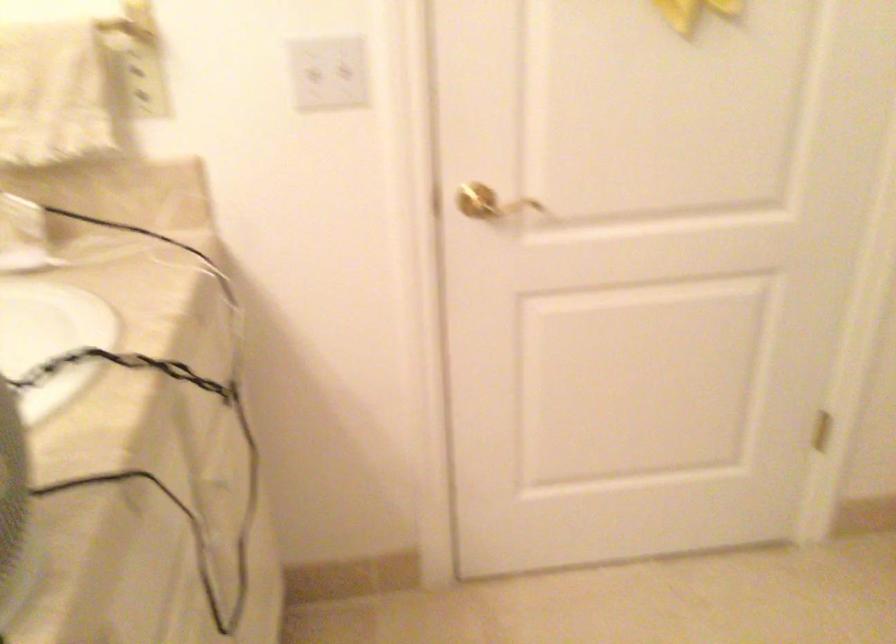
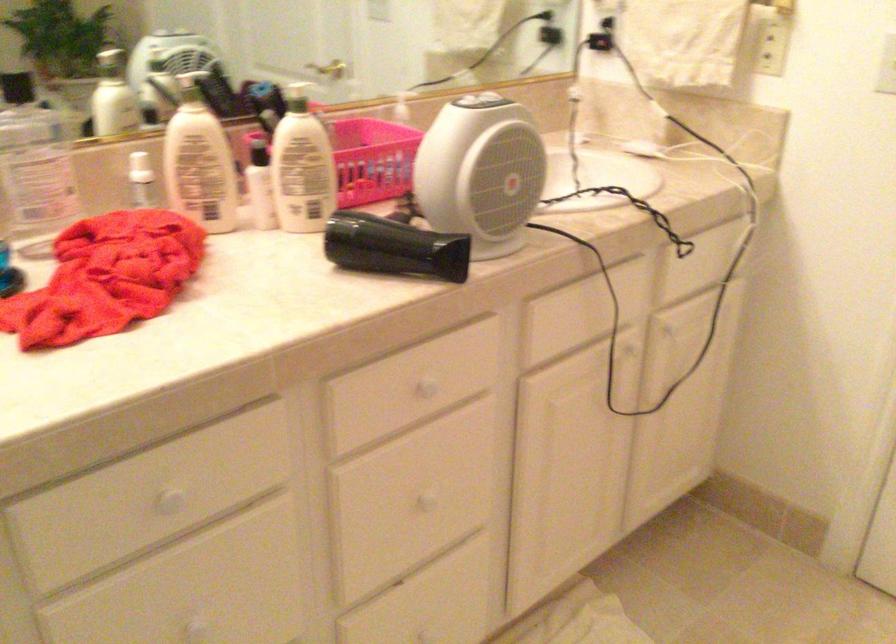
Find the pixel in the second image that matches (x=152, y=75) in the first image.

(771, 46)